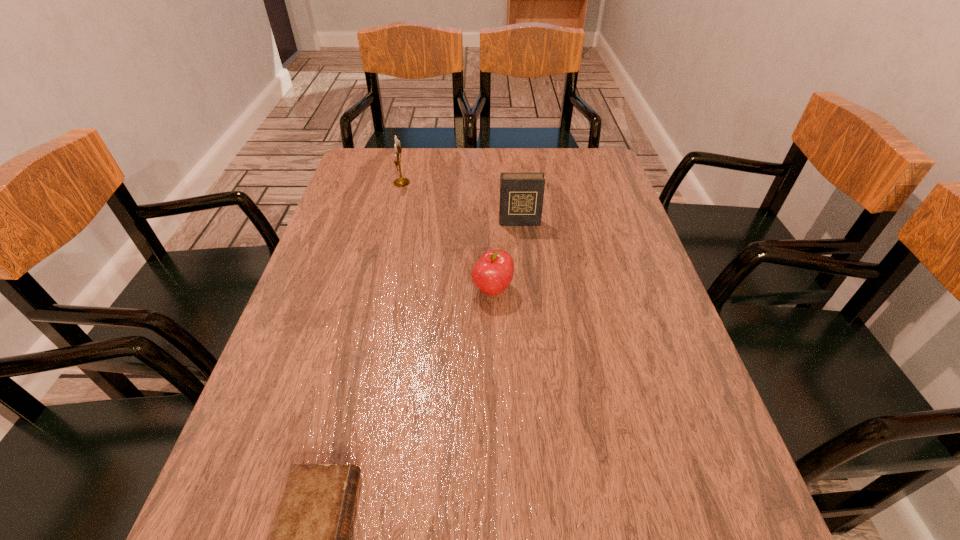
Find the location of a particular element. This screenshot has height=540, width=960. vacant space that satisfies the following two spatial constraints: 1. on the front side of the farthest object; 2. on the left side of the apple is located at coordinates (376, 289).